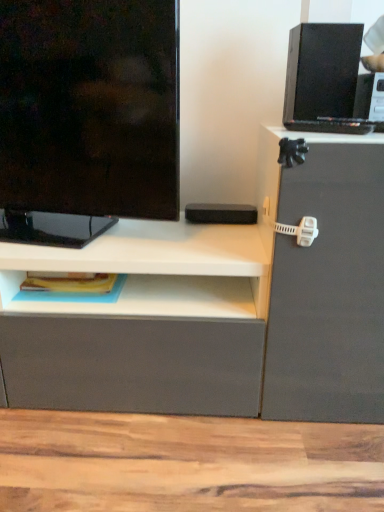
Question: Which is correct: matte black television at left is inside black matte speaker at upper right, or outside of it?

Choices:
 (A) inside
 (B) outside

Answer: (B)

Question: In terms of width, does matte black television at left look wider or thinner when compared to black matte speaker at upper right?

Choices:
 (A) wide
 (B) thin

Answer: (B)

Question: Based on their positions, is matte black television at left located to the left or right of black matte speaker at upper right?

Choices:
 (A) left
 (B) right

Answer: (A)

Question: Is point tap(359, 37) closer or farther from the camera than point tap(94, 203)?

Choices:
 (A) farther
 (B) closer

Answer: (B)

Question: In the image, is black matte speaker at upper right on the left side or the right side of matte black television at left?

Choices:
 (A) right
 (B) left

Answer: (A)

Question: In terms of width, does black matte speaker at upper right look wider or thinner when compared to matte black television at left?

Choices:
 (A) thin
 (B) wide

Answer: (B)

Question: From the image's perspective, is black matte speaker at upper right positioned above or below matte black television at left?

Choices:
 (A) above
 (B) below

Answer: (A)